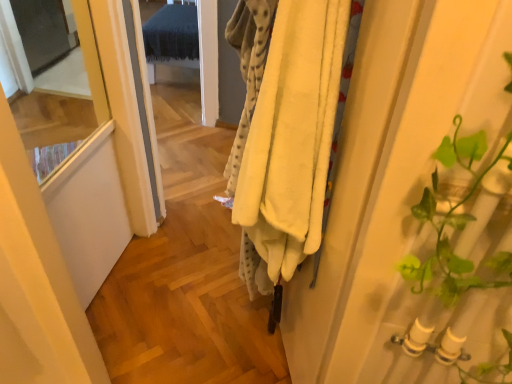
What do you see at coordinates (287, 129) in the screenshot? I see `soft yellow fleece blanket at center` at bounding box center [287, 129].

Where is `soft yellow fleece blanket at center`? This screenshot has width=512, height=384. soft yellow fleece blanket at center is located at coordinates (287, 129).

Measure the distance between transparent glass screen door at upper left and camera.

2.67 meters.

This screenshot has width=512, height=384. Describe the element at coordinates (42, 32) in the screenshot. I see `transparent glass screen door at upper left` at that location.

The height and width of the screenshot is (384, 512). I want to click on transparent glass screen door at upper left, so click(x=42, y=32).

Image resolution: width=512 pixels, height=384 pixels. I want to click on soft yellow fleece blanket at center, so click(287, 129).

Which object is positioned more to the right, transparent glass screen door at upper left or soft yellow fleece blanket at center?

From the viewer's perspective, soft yellow fleece blanket at center appears more on the right side.

Is transparent glass screen door at upper left closer to camera compared to soft yellow fleece blanket at center?

No, it is not.

Between point (54, 61) and point (282, 8), which one is positioned in front?

The point (282, 8) is more forward.

Based on the photo, from the image's perspective, relative to soft yellow fleece blanket at center, is transparent glass screen door at upper left above or below?

From the image's perspective, transparent glass screen door at upper left appears above soft yellow fleece blanket at center.

From a real-world perspective, which object stands above the other?

From a 3D spatial view, soft yellow fleece blanket at center is above.

Which of these two, transparent glass screen door at upper left or soft yellow fleece blanket at center, is wider?

transparent glass screen door at upper left is wider.

Who is taller, transparent glass screen door at upper left or soft yellow fleece blanket at center?

Standing taller between the two is soft yellow fleece blanket at center.

Which of these two, transparent glass screen door at upper left or soft yellow fleece blanket at center, is bigger?

Bigger between the two is transparent glass screen door at upper left.

Is transparent glass screen door at upper left inside the boundaries of soft yellow fleece blanket at center, or outside?

transparent glass screen door at upper left is spatially situated outside soft yellow fleece blanket at center.

Is transparent glass screen door at upper left directly adjacent to soft yellow fleece blanket at center?

No, transparent glass screen door at upper left is not beside soft yellow fleece blanket at center.

Looking at this image, is transparent glass screen door at upper left positioned with its back to soft yellow fleece blanket at center?

No, soft yellow fleece blanket at center is not at the back of transparent glass screen door at upper left.

Could you measure the distance between transparent glass screen door at upper left and soft yellow fleece blanket at center?

2.60 meters.

Locate an element on the screen. Image resolution: width=512 pixels, height=384 pixels. screen door on the left of soft yellow fleece blanket at center is located at coordinates (42, 32).

Considering the positions of objects soft yellow fleece blanket at center and transparent glass screen door at upper left in the image provided, who is more to the left, soft yellow fleece blanket at center or transparent glass screen door at upper left?

Positioned to the left is transparent glass screen door at upper left.

Who is more distant, soft yellow fleece blanket at center or transparent glass screen door at upper left?

Positioned behind is transparent glass screen door at upper left.

Which is closer to the camera, (246, 149) or (49, 49)?

The point (246, 149) is more forward.

From the image's perspective, is soft yellow fleece blanket at center over transparent glass screen door at upper left?

Actually, soft yellow fleece blanket at center appears below transparent glass screen door at upper left in the image.

From a real-world perspective, which is physically below, soft yellow fleece blanket at center or transparent glass screen door at upper left?

transparent glass screen door at upper left, from a real-world perspective.

Which object is wider, soft yellow fleece blanket at center or transparent glass screen door at upper left?

transparent glass screen door at upper left is wider.

Between soft yellow fleece blanket at center and transparent glass screen door at upper left, which one has more height?

Standing taller between the two is soft yellow fleece blanket at center.

Does soft yellow fleece blanket at center have a larger size compared to transparent glass screen door at upper left?

No.

Which is correct: soft yellow fleece blanket at center is inside transparent glass screen door at upper left, or outside of it?

soft yellow fleece blanket at center is spatially situated outside transparent glass screen door at upper left.

Is soft yellow fleece blanket at center next to transparent glass screen door at upper left?

soft yellow fleece blanket at center and transparent glass screen door at upper left are clearly separated.

Is soft yellow fleece blanket at center positioned with its back to transparent glass screen door at upper left?

No, transparent glass screen door at upper left is not at the back of soft yellow fleece blanket at center.

Measure the distance from soft yellow fleece blanket at center to transparent glass screen door at upper left.

2.60 meters.

You are a GUI agent. You are given a task and a screenshot of the screen. Output one action in this format:
    pyautogui.click(x=<x>, y=<y>)
    Task: Click on the screen door that is above the soft yellow fleece blanket at center (from the image's perspective)
    
    Given the screenshot: What is the action you would take?
    tap(42, 32)

Where is `clothing below the transparent glass screen door at upper left (from the image's perspective)`? Image resolution: width=512 pixels, height=384 pixels. clothing below the transparent glass screen door at upper left (from the image's perspective) is located at coordinates (287, 129).

At what (x,y) coordinates should I click in order to perform the action: click on clothing on the right of transparent glass screen door at upper left. Please return your answer as a coordinate pair (x, y). The image size is (512, 384). Looking at the image, I should click on (287, 129).